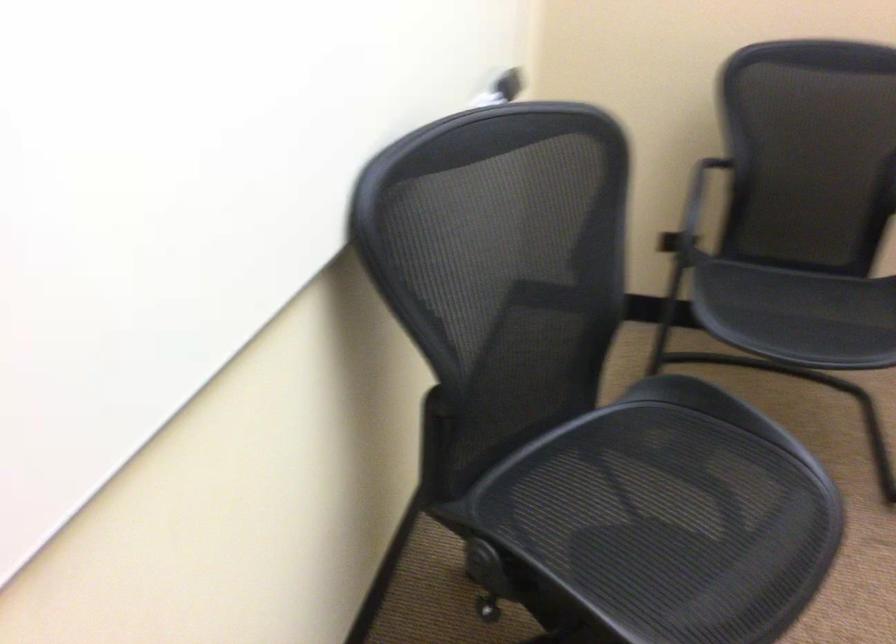
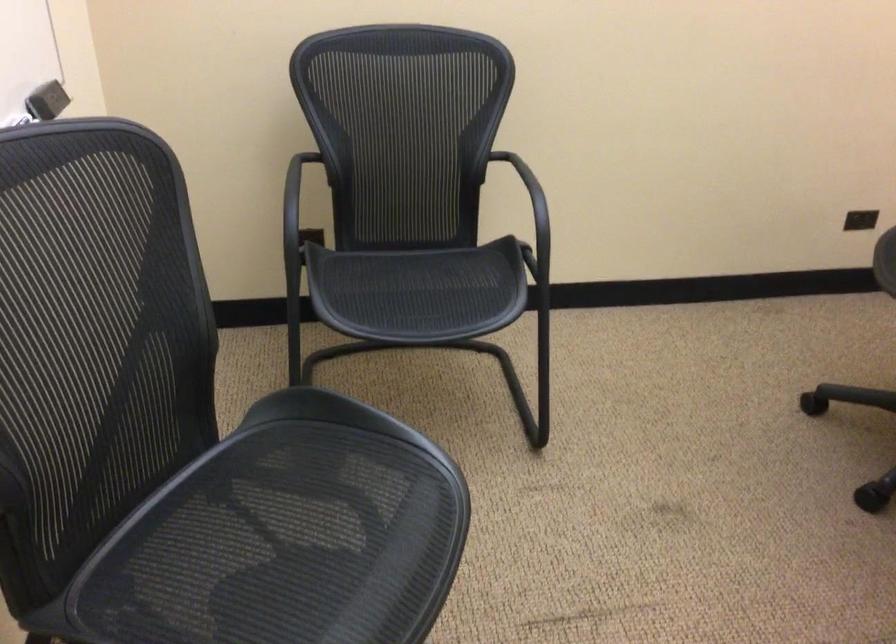
Question: The first image is from the beginning of the video and the second image is from the end. How did the camera likely rotate when shooting the video?

Choices:
 (A) Left
 (B) Right
 (C) Up
 (D) Down

Answer: (B)